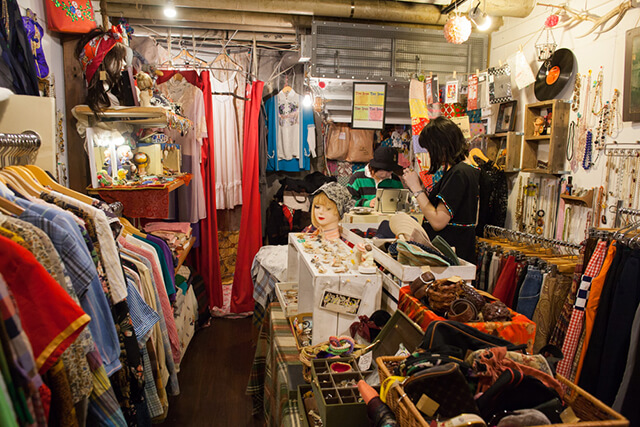
I want to click on hanger, so click(x=233, y=48).